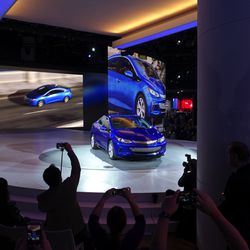
Identify the location of stage. The width and height of the screenshot is (250, 250). (92, 166).